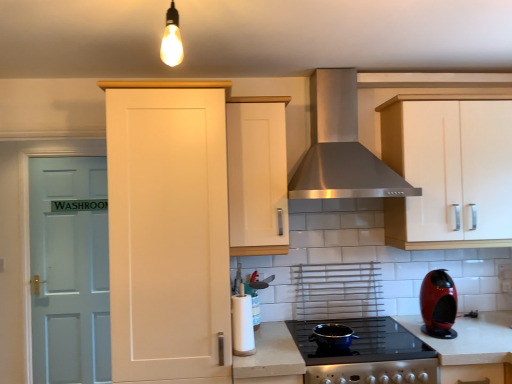
Question: Can you confirm if stainless steel range hood at center is taller than shiny red coffee machine at right?

Choices:
 (A) yes
 (B) no

Answer: (A)

Question: Is stainless steel range hood at center next to shiny red coffee machine at right?

Choices:
 (A) no
 (B) yes

Answer: (A)

Question: From the image's perspective, is stainless steel range hood at center above shiny red coffee machine at right?

Choices:
 (A) no
 (B) yes

Answer: (B)

Question: Can you confirm if stainless steel range hood at center is bigger than shiny red coffee machine at right?

Choices:
 (A) no
 (B) yes

Answer: (B)

Question: From a real-world perspective, is stainless steel range hood at center located higher than shiny red coffee machine at right?

Choices:
 (A) no
 (B) yes

Answer: (B)

Question: Is stainless steel range hood at center positioned with its back to shiny red coffee machine at right?

Choices:
 (A) no
 (B) yes

Answer: (A)

Question: Considering the relative sizes of black glass cooktop at center and white matte cabinet at upper right, which is the 3th cabinetry in left-to-right order, in the image provided, is black glass cooktop at center bigger than white matte cabinet at upper right, which is the 3th cabinetry in left-to-right order,?

Choices:
 (A) no
 (B) yes

Answer: (A)

Question: From the image's perspective, is black glass cooktop at center beneath white matte cabinet at upper right, marked as the 1th cabinetry in a right-to-left arrangement?

Choices:
 (A) no
 (B) yes

Answer: (B)

Question: Does black glass cooktop at center appear on the left side of white matte cabinet at upper right, which is the 3th cabinetry in left-to-right order?

Choices:
 (A) no
 (B) yes

Answer: (B)

Question: Is black glass cooktop at center positioned far away from white matte cabinet at upper right, marked as the 1th cabinetry in a right-to-left arrangement?

Choices:
 (A) no
 (B) yes

Answer: (A)

Question: Is black glass cooktop at center in front of white matte cabinet at upper right, which is the 3th cabinetry in left-to-right order?

Choices:
 (A) no
 (B) yes

Answer: (B)

Question: Can you confirm if black glass cooktop at center is smaller than white matte cabinet at upper right, which is the 3th cabinetry in left-to-right order?

Choices:
 (A) yes
 (B) no

Answer: (A)

Question: Is light blue wood door at left positioned before white matte cabinet at upper right, which is the 3th cabinetry in left-to-right order?

Choices:
 (A) no
 (B) yes

Answer: (A)